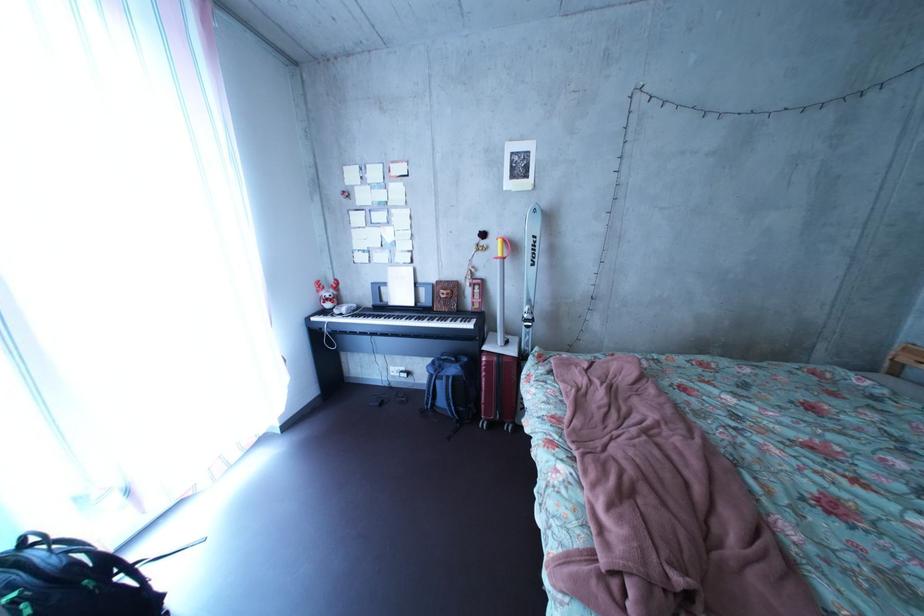
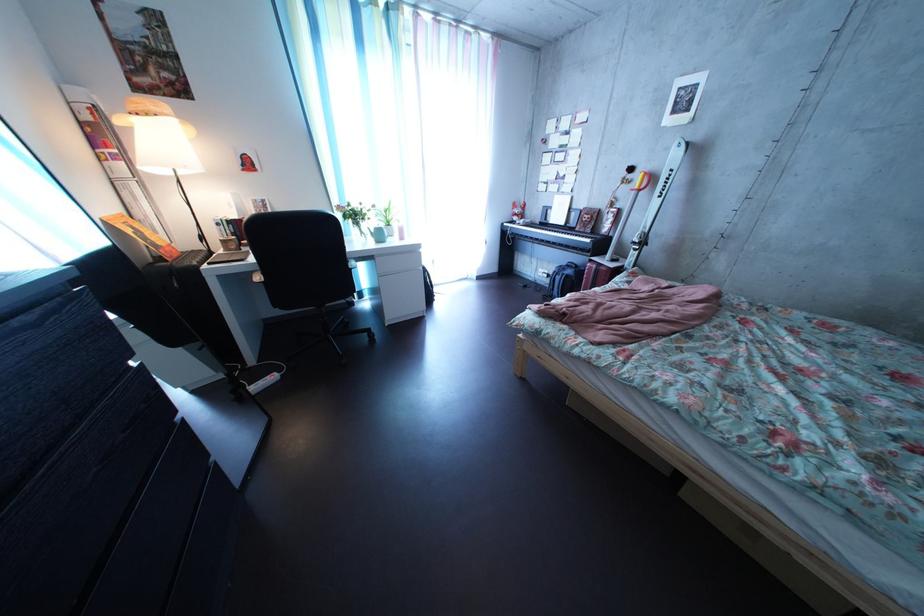
Find the pixel in the second image that matches (x=407, y=377) in the first image.

(554, 278)